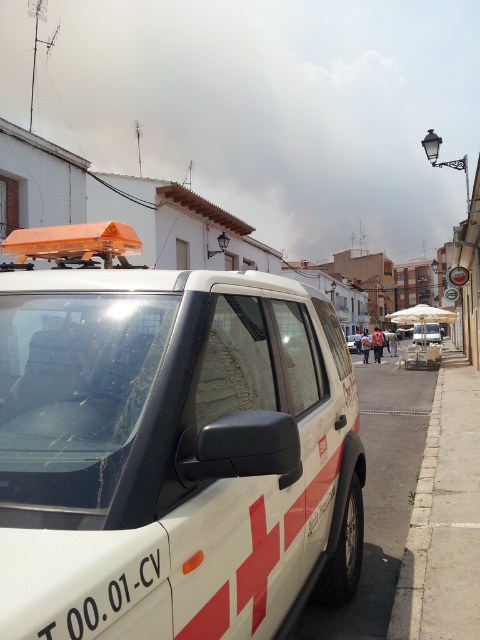
You are a delivery driver who needs to read the license plate of the white emergency vehicle. However, there is a gray concrete curb at lower right blocking your view. Can you still see the white plastic license plate at center?

The white plastic license plate at center is behind the gray concrete curb at lower right, so it is blocked and cannot be seen.

You are a delivery driver trying to park your truck on the narrow road where the white matte ambulance at center is parked. The parking spot you want is directly behind the ambulance. According to the parking regulations, vehicles must be parked at least 1.5 meters away from emergency vehicles. Can you park your truck there?

The white matte ambulance at center is an emergency vehicle, and parking regulations require staying at least 1.5 meters away. Therefore, you cannot park your truck directly behind it as it violates the safety distance.

You are a pedestrian standing on the sidewalk. You see the white matte ambulance at center and the white matte emergency vehicle at center. Which one is closer to you?

The white matte ambulance at center is closer to you because it is positioned over the white matte emergency vehicle at center, indicating it is in front.